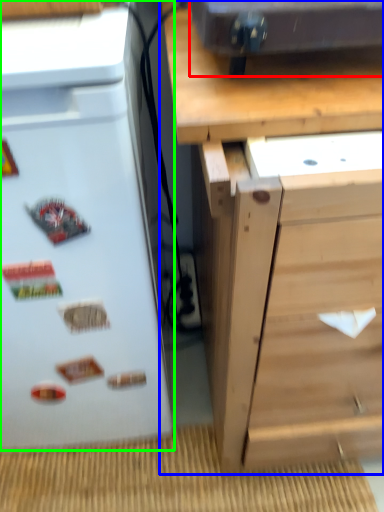
Question: Considering the real-world distances, which object is farthest from appliance (highlighted by a red box)? chest of drawers (highlighted by a blue box) or refrigerator (highlighted by a green box)?

Choices:
 (A) chest of drawers
 (B) refrigerator

Answer: (B)